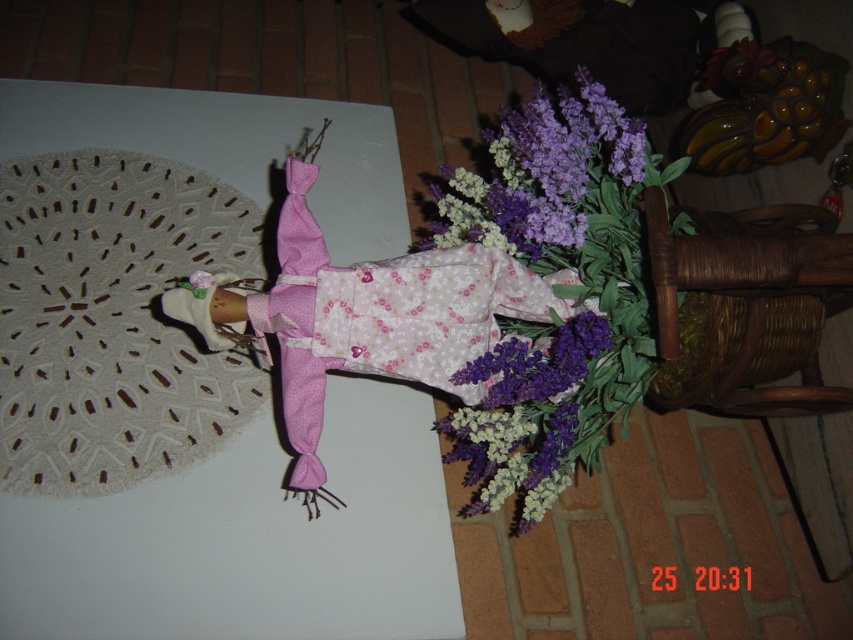
Is point (456, 424) positioned before point (418, 330)?

No, (456, 424) is further to viewer.

Does lavender bouquet at center lie in front of pink fabric dress at center?

No, lavender bouquet at center is behind pink fabric dress at center.

Who is more distant from viewer, (556, 360) or (492, 268)?

Positioned behind is point (556, 360).

The width and height of the screenshot is (853, 640). I want to click on lavender bouquet at center, so click(x=554, y=291).

Is pink fabric dress at center positioned at the back of purple matte flowers at upper center?

No.

Is point (488, 250) more distant than point (564, 150)?

No, it is in front of (564, 150).

This screenshot has width=853, height=640. I want to click on pink fabric dress at center, so click(381, 316).

Who is shorter, lavender bouquet at center or purple matte flowers at upper center?

With less height is purple matte flowers at upper center.

Consider the image. Who is lower down, lavender bouquet at center or purple matte flowers at upper center?

lavender bouquet at center is below.

Who is more distant from viewer, (606, 356) or (521, 141)?

Positioned behind is point (521, 141).

What are the coordinates of `lavender bouquet at center` in the screenshot? It's located at (554, 291).